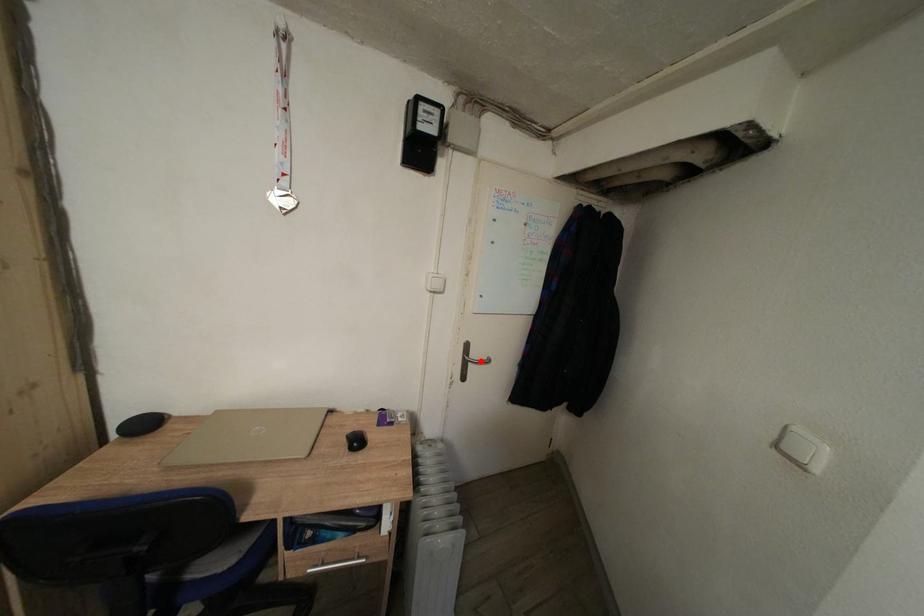
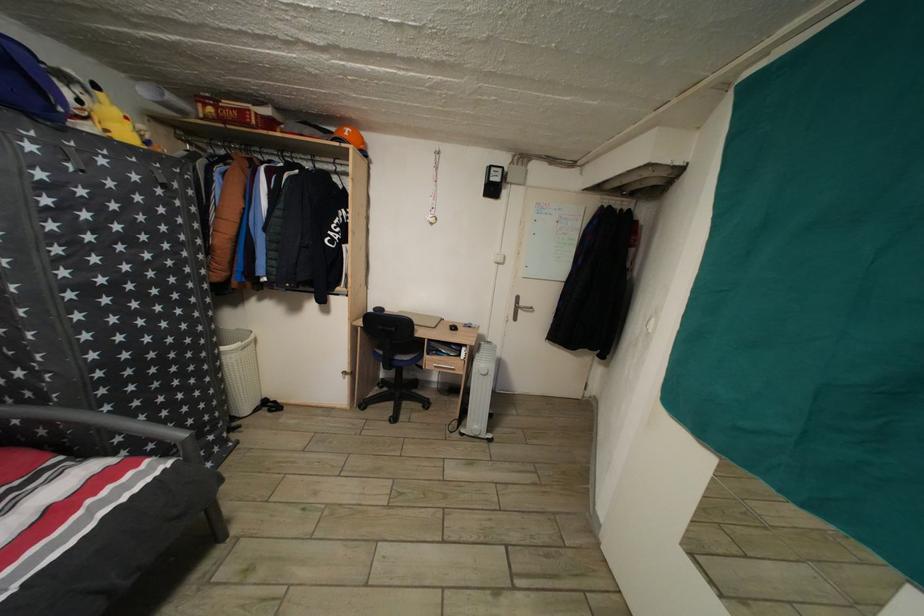
Find the pixel in the second image that matches the highlighted location in the first image.

(529, 310)